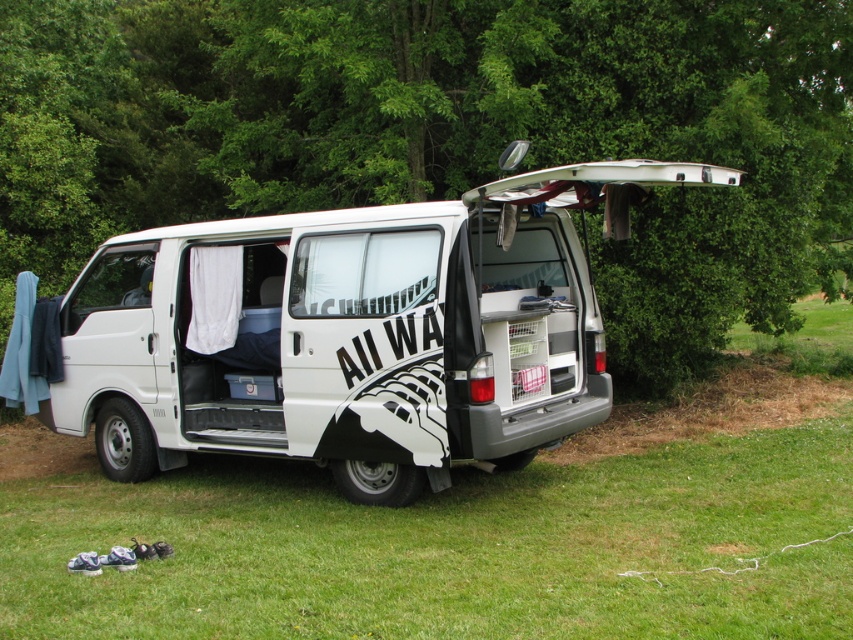
The width and height of the screenshot is (853, 640). What do you see at coordinates (444, 132) in the screenshot? I see `green leafy tree at upper center` at bounding box center [444, 132].

Between point (161, 122) and point (198, 381), which one is positioned in front?

Point (198, 381) is more forward.

Locate an element on the screen. green leafy tree at upper center is located at coordinates (444, 132).